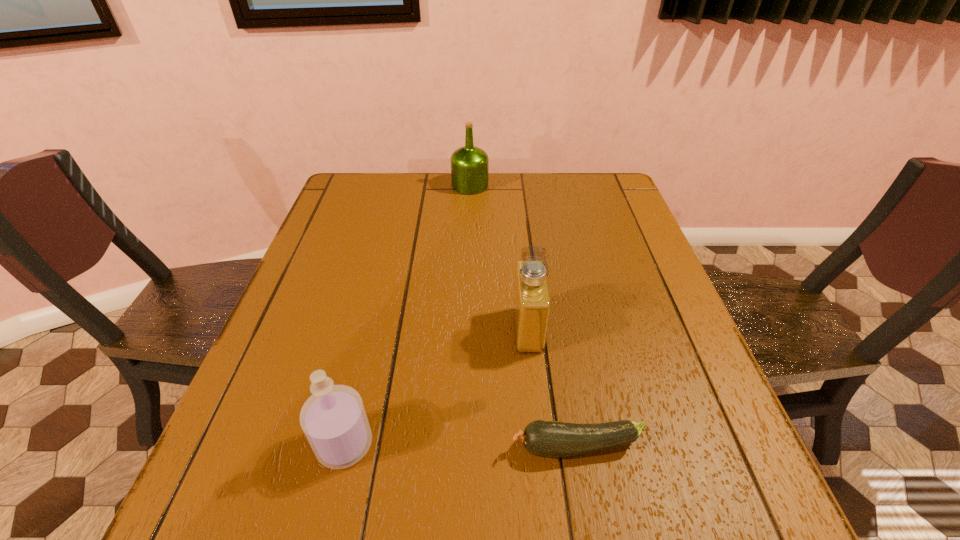
I want to click on blank space at the right edge of the desktop, so click(594, 258).

The height and width of the screenshot is (540, 960). What are the coordinates of `vacant space at the far left corner of the desktop` in the screenshot? It's located at (380, 184).

Find the location of a particular element. The image size is (960, 540). vacant space at the far right corner of the desktop is located at coordinates (574, 199).

I want to click on vacant space in between the second farthest object and the second object from left to right, so click(499, 258).

This screenshot has height=540, width=960. What are the coordinates of `free point between the leftmost object and the farthest object` in the screenshot? It's located at (407, 315).

Where is `free spot between the farther perfume and the nearer perfume`? This screenshot has width=960, height=540. free spot between the farther perfume and the nearer perfume is located at coordinates (436, 387).

Where is `vacant area that lies between the shortest object and the left perfume`? This screenshot has width=960, height=540. vacant area that lies between the shortest object and the left perfume is located at coordinates [x=461, y=446].

The image size is (960, 540). Find the location of `vacant area between the second object from left to right and the nearer perfume`. vacant area between the second object from left to right and the nearer perfume is located at coordinates (407, 315).

Find the location of a particular element. The height and width of the screenshot is (540, 960). vacant space in between the olive oil and the right perfume is located at coordinates pos(499,258).

Locate an element on the screen. The width and height of the screenshot is (960, 540). object that is the third closest to the zucchini is located at coordinates (469, 165).